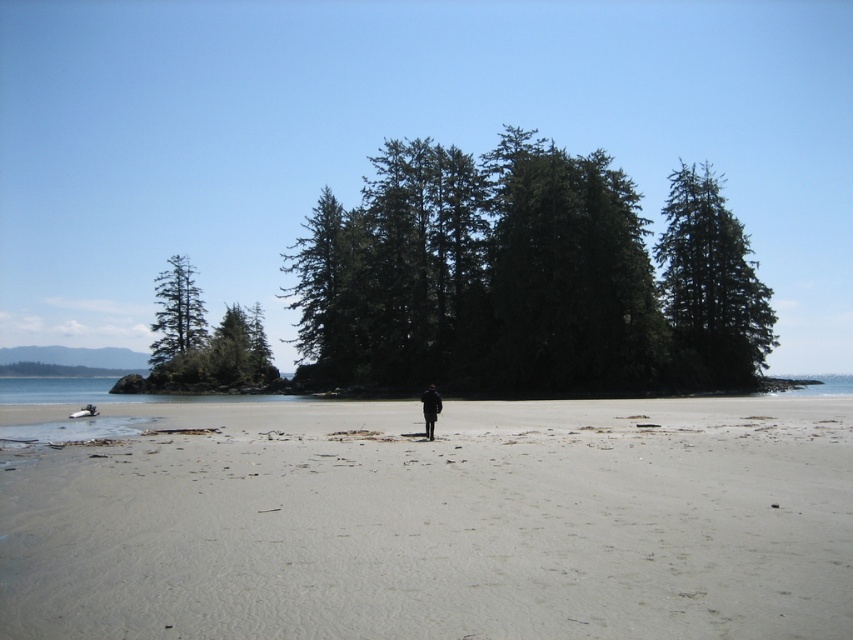
You are standing on the beach and want to walk from the green matte tree at left to the light beige sand at center. Which direction should you head?

You should head downward towards the light beige sand at center since it is located below the green matte tree at left.

You are standing on the beach and see the light beige sand at center and the green matte trees at center. Which object is positioned to the right of the other?

The light beige sand at center is to the right of the green matte trees at center.

You are standing at the edge of the beach and want to place a small flag exactly where the light beige sand at center is located. According to the coordinates provided, where should you place the flag?

The light beige sand at center is located at point (440, 524), so you should place the flag at those coordinates.